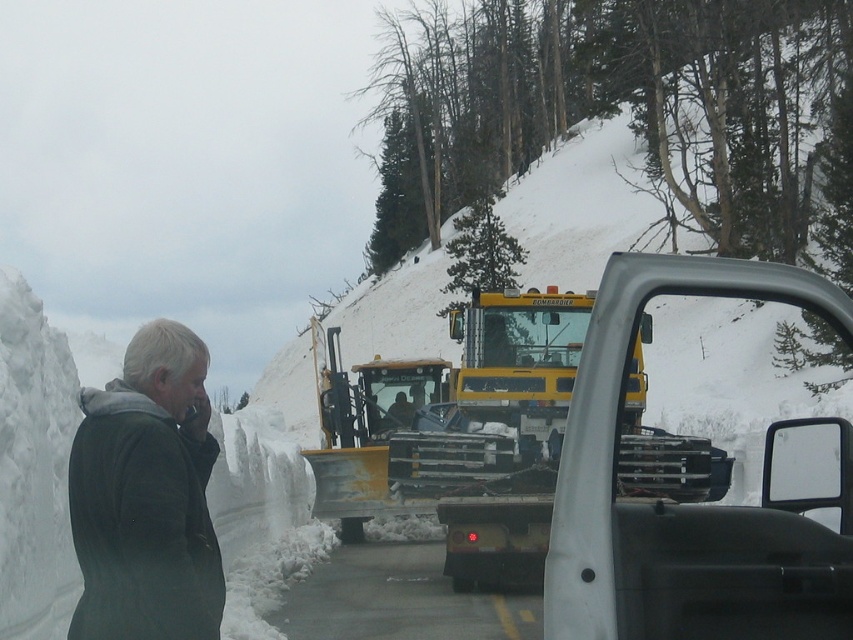
You are a snowplow operator who needs to position your BOMAG snowplow to clear a path for the metallic silver trailer truck at center. Based on the coordinates provided, where should you aim the snowplow to ensure the trailer truck can pass through?

The metallic silver trailer truck at center is located at point (663, 504), so you should aim the snowplow towards that coordinate to clear the path for the trailer truck.

You are a pedestrian trying to cross the road in this snowy scene. You see the metallic silver trailer truck at center and the dark gray jacket at left. Which object is closer to you as you stand on the side of the road?

The metallic silver trailer truck at center is closer to you because it is in front of the dark gray jacket at left, meaning it is nearer in the line of sight.

You are a snowplow operator in the BOMAG vehicle. You need to clear snow from the road. There are two points marked on your map. The first point is at coordinate point[599,632] and the second point is at coordinate point[196,468]. Which point should you reach first if you want to clear the snow in the most efficient way?

You should reach point[599,632] first because it is in front of point[196,468], so clearing it first would allow you to proceed towards the latter without obstruction.